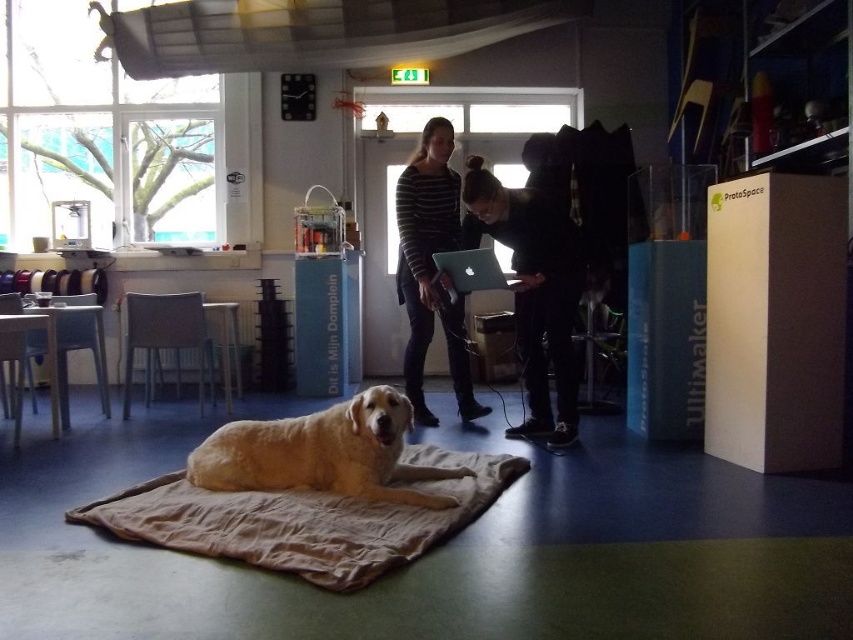
Question: Considering the real-world distances, which object is closest to the striped sweater at center?

Choices:
 (A) golden fur dog at center
 (B) silver metallic laptop at center

Answer: (B)

Question: Based on their relative distances, which object is nearer to the beige fabric mat at lower center?

Choices:
 (A) golden fur dog at center
 (B) striped sweater at center
 (C) silver metallic laptop at center

Answer: (A)

Question: Where is golden fur dog at center located in relation to black fabric jacket at center in the image?

Choices:
 (A) above
 (B) below

Answer: (B)

Question: Which of these objects is positioned closest to the black fabric jacket at center?

Choices:
 (A) silver metallic laptop at center
 (B) golden fur dog at center
 (C) beige fabric mat at lower center

Answer: (A)

Question: Can you confirm if golden fur dog at center is thinner than black fabric jacket at center?

Choices:
 (A) yes
 (B) no

Answer: (B)

Question: Is beige fabric mat at lower center bigger than black fabric jacket at center?

Choices:
 (A) no
 (B) yes

Answer: (A)